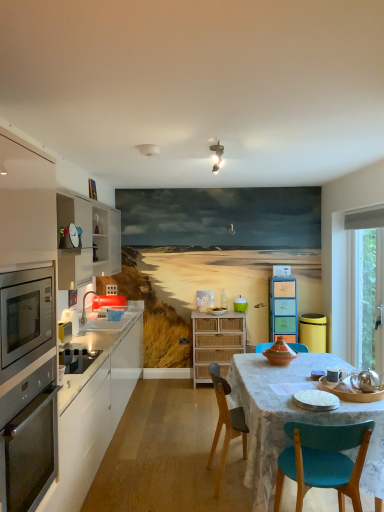
Question: Considering the positions of teal plastic container at center and white matte cabinet at left, marked as the third cabinetry in a right-to-left arrangement, in the image, is teal plastic container at center bigger or smaller than white matte cabinet at left, marked as the third cabinetry in a right-to-left arrangement,?

Choices:
 (A) big
 (B) small

Answer: (B)

Question: From the image's perspective, is teal plastic container at center located above or below white matte cabinet at left, which is the first cabinetry from left to right?

Choices:
 (A) below
 (B) above

Answer: (B)

Question: Which object is positioned farthest from the woven wood cabinet at center, the second cabinetry viewed from the left?

Choices:
 (A) white matte cabinet at left, marked as the third cabinetry in a right-to-left arrangement
 (B) silver metallic teapot at lower right, the 2th appliance from the top
 (C) transparent glass window at right
 (D) teal plastic container at center
 (E) metallic stainless steel oven at left

Answer: (E)

Question: Estimate the real-world distances between objects in this image. Which object is closer to the transparent glass window at right?

Choices:
 (A) metallic microwave at center-left, marked as the first appliance in a back-to-front arrangement
 (B) white ceramic plates at center, placed as the 1th appliance when sorted from front to back
 (C) pastel wood drawers at center, the 3th cabinetry in the left-to-right sequence
 (D) woven wood cabinet at center, marked as the second cabinetry in a right-to-left arrangement
 (E) stainless steel oven at left

Answer: (C)